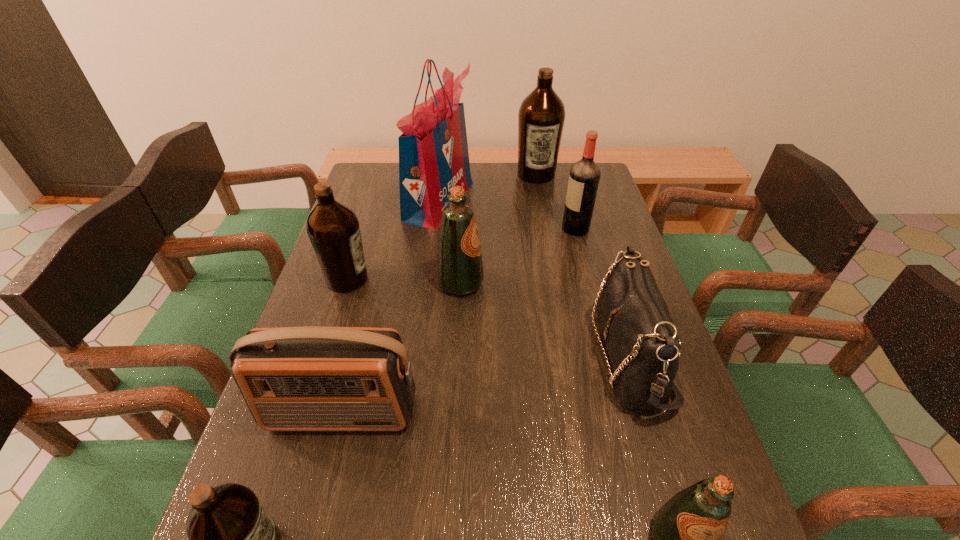
Identify which brown olive oil is the third closest to the red grocery bag. Please provide its 2D coordinates. Your answer should be formatted as a tuple, i.e. [(x, y)], where the tuple contains the x and y coordinates of a point satisfying the conditions above.

[(231, 538)]

I want to click on vacant space that satisfies the following two spatial constraints: 1. at the front of the handbag with chain and zipper; 2. on the front-facing side of the radio receiver, so click(647, 413).